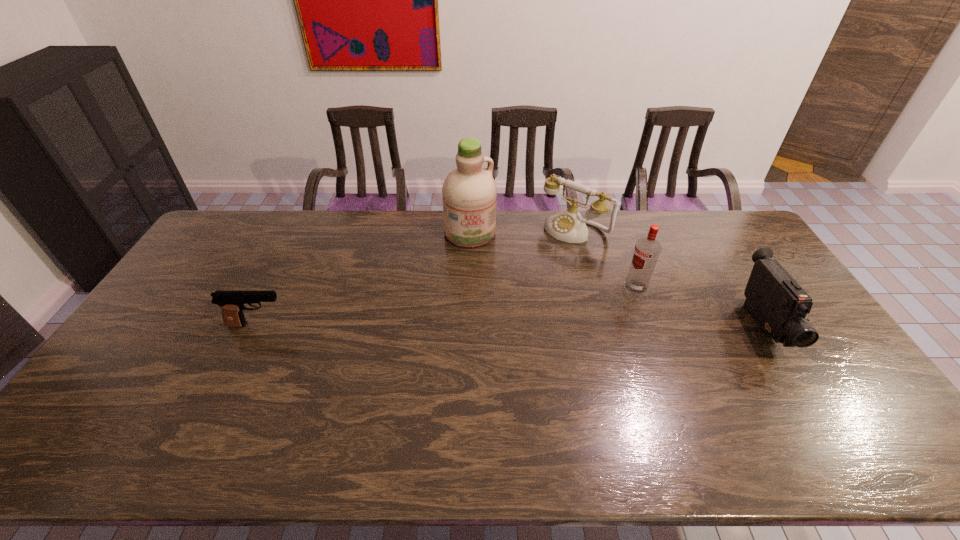
I want to click on pistol, so click(232, 302).

Image resolution: width=960 pixels, height=540 pixels. In order to click on the leftmost object in this screenshot , I will do `click(232, 302)`.

Locate an element on the screen. The width and height of the screenshot is (960, 540). camcorder is located at coordinates (778, 303).

Where is `cleansing agent`? The image size is (960, 540). cleansing agent is located at coordinates (469, 192).

This screenshot has height=540, width=960. In order to click on the tallest object in this screenshot , I will do pyautogui.click(x=469, y=192).

The height and width of the screenshot is (540, 960). I want to click on telephone, so (x=568, y=225).

You are a GUI agent. You are given a task and a screenshot of the screen. Output one action in this format:
    pyautogui.click(x=<x>, y=<y>)
    Task: Click on the fourth shortest object
    
    Given the screenshot: What is the action you would take?
    pyautogui.click(x=647, y=250)

The height and width of the screenshot is (540, 960). Find the location of `free space located 0.300m at the barrel of the shortest object`. free space located 0.300m at the barrel of the shortest object is located at coordinates (389, 325).

Where is `vacant space situated on the front-facing side of the camcorder`? The width and height of the screenshot is (960, 540). vacant space situated on the front-facing side of the camcorder is located at coordinates tap(819, 419).

You are a GUI agent. You are given a task and a screenshot of the screen. Output one action in this format:
    pyautogui.click(x=<x>, y=<y>)
    Task: Click on the vacant space located on the front label of the cleansing agent
    The image size is (960, 540).
    Given the screenshot: What is the action you would take?
    pyautogui.click(x=505, y=325)